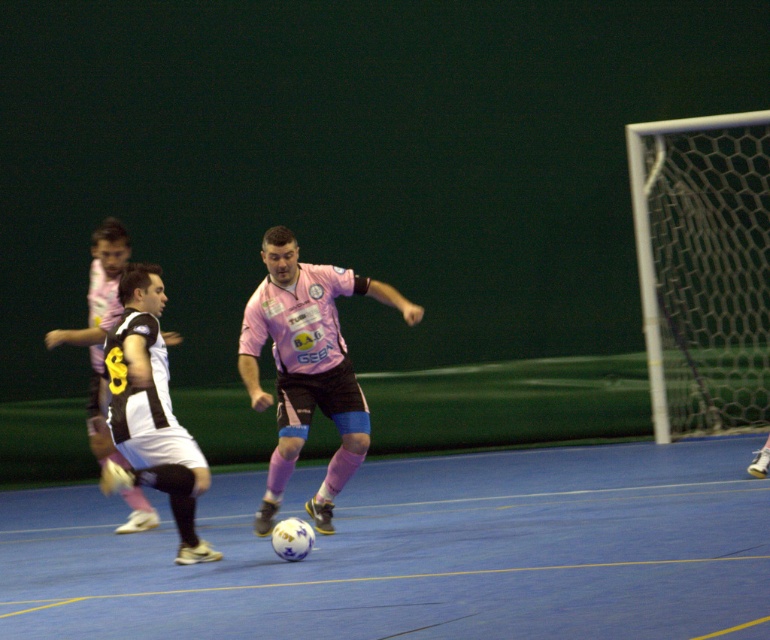
Can you confirm if pink matte jersey at center is positioned below white matte jersey at center?

No.

Who is more distant from viewer, (275, 292) or (139, 481)?

The point (275, 292) is more distant.

Locate an element on the screen. pink matte jersey at center is located at coordinates (308, 365).

Between blue synthetic floor at center and white matte jersey at center, which one has less height?

blue synthetic floor at center is shorter.

Is blue synthetic floor at center to the left of white matte jersey at center from the viewer's perspective?

Incorrect, blue synthetic floor at center is not on the left side of white matte jersey at center.

Where is `blue synthetic floor at center`? Image resolution: width=770 pixels, height=640 pixels. blue synthetic floor at center is located at coordinates [x=420, y=552].

Does white matte jersey at center have a greater width compared to black and white jersey at left?

Correct, the width of white matte jersey at center exceeds that of black and white jersey at left.

How much distance is there between white matte jersey at center and black and white jersey at left?

1.14 meters

At what (x,y) coordinates should I click in order to perform the action: click on white matte jersey at center. Please return your answer as a coordinate pair (x, y). Looking at the image, I should click on (149, 410).